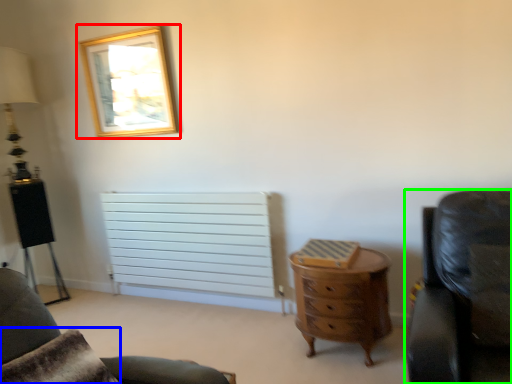
Question: Which object is the closest to the picture frame (highlighted by a red box)? Choose among these: pillow (highlighted by a blue box) or chair (highlighted by a green box).

Choices:
 (A) pillow
 (B) chair

Answer: (A)